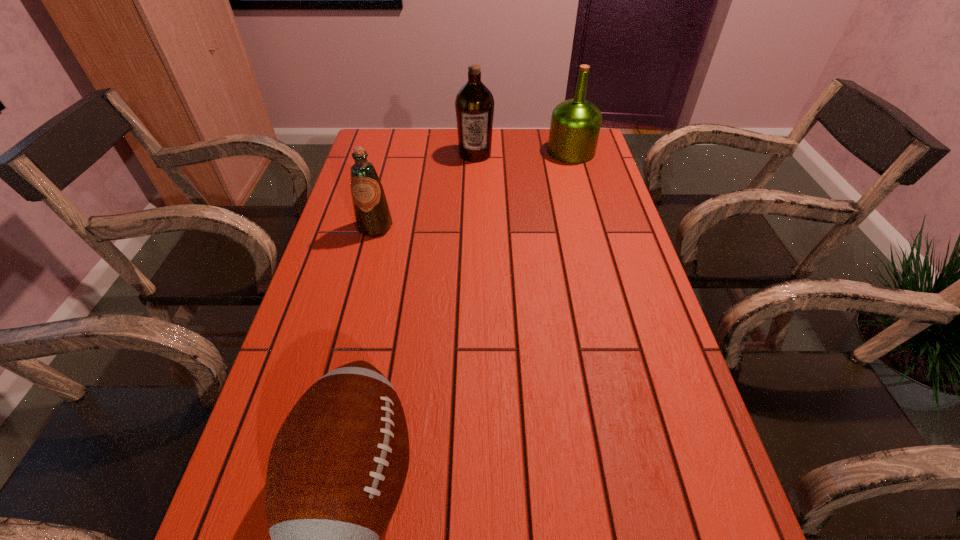
Where is `object that is the nearest to the football`? Image resolution: width=960 pixels, height=540 pixels. object that is the nearest to the football is located at coordinates (371, 211).

Select which object appears as the third closest to the second olive oil from right to left. Please provide its 2D coordinates. Your answer should be formatted as a tuple, i.e. [(x, y)], where the tuple contains the x and y coordinates of a point satisfying the conditions above.

[(336, 470)]

This screenshot has width=960, height=540. Identify the location of olive oil identified as the closest to the second object from right to left. (575, 125).

Locate an element on the screen. olive oil that is the nearest to the rightmost olive oil is located at coordinates (x=474, y=105).